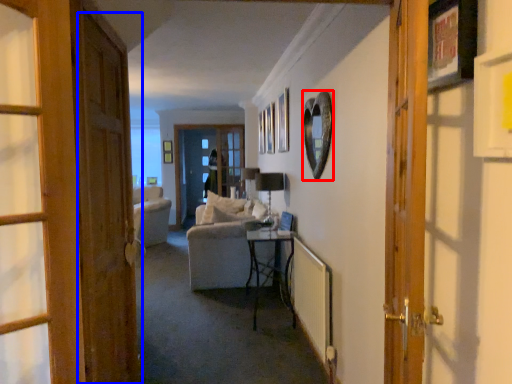
Question: Which object appears farthest to the camera in this image, picture frame (highlighted by a red box) or door (highlighted by a blue box)?

Choices:
 (A) picture frame
 (B) door

Answer: (A)